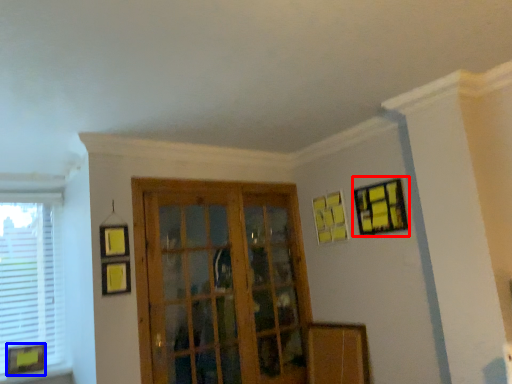
Question: Which point is further to the camera, picture frame (highlighted by a red box) or picture frame (highlighted by a blue box)?

Choices:
 (A) picture frame
 (B) picture frame

Answer: (B)